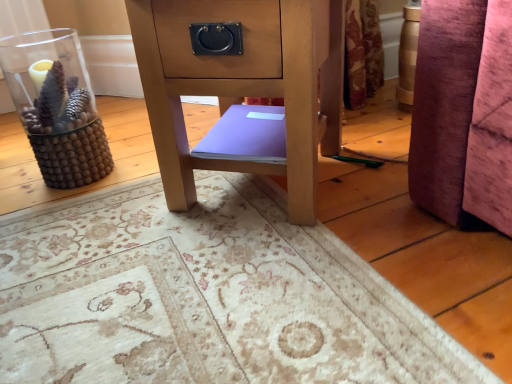
Question: From a real-world perspective, is matte wood side table at center physically above transparent glass vase at left?

Choices:
 (A) yes
 (B) no

Answer: (A)

Question: Is matte wood side table at center thinner than transparent glass vase at left?

Choices:
 (A) no
 (B) yes

Answer: (A)

Question: Is matte wood side table at center aimed at transparent glass vase at left?

Choices:
 (A) no
 (B) yes

Answer: (A)

Question: Considering the relative sizes of matte wood side table at center and transparent glass vase at left in the image provided, is matte wood side table at center smaller than transparent glass vase at left?

Choices:
 (A) yes
 (B) no

Answer: (B)

Question: Is matte wood side table at center oriented away from transparent glass vase at left?

Choices:
 (A) no
 (B) yes

Answer: (A)

Question: Is matte wood side table at center shorter than transparent glass vase at left?

Choices:
 (A) yes
 (B) no

Answer: (B)

Question: From the image's perspective, is purple matte book at center under matte wood side table at center?

Choices:
 (A) no
 (B) yes

Answer: (B)

Question: Could you tell me if purple matte book at center is turned towards matte wood side table at center?

Choices:
 (A) no
 (B) yes

Answer: (B)

Question: Does purple matte book at center have a greater width compared to matte wood side table at center?

Choices:
 (A) yes
 (B) no

Answer: (B)

Question: Considering the relative positions of purple matte book at center and matte wood side table at center in the image provided, is purple matte book at center to the right of matte wood side table at center from the viewer's perspective?

Choices:
 (A) no
 (B) yes

Answer: (A)

Question: Is purple matte book at center not close to matte wood side table at center?

Choices:
 (A) no
 (B) yes

Answer: (A)

Question: Does purple matte book at center have a lesser width compared to matte wood side table at center?

Choices:
 (A) no
 (B) yes

Answer: (B)

Question: From a real-world perspective, does transparent glass vase at left sit lower than purple matte book at center?

Choices:
 (A) no
 (B) yes

Answer: (A)